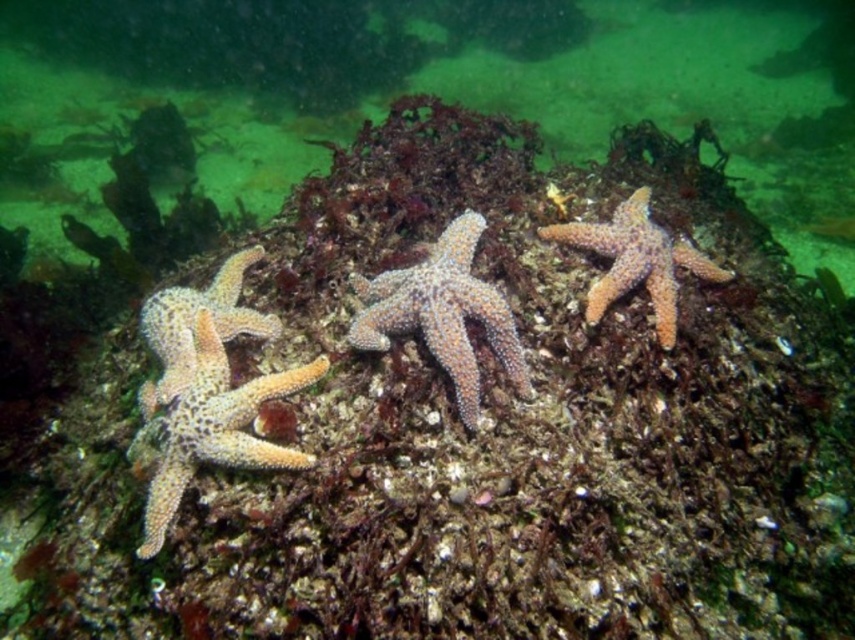
Does orange spiny starfish at upper right have a smaller size compared to orange spiny starfish at left?

Actually, orange spiny starfish at upper right might be larger than orange spiny starfish at left.

Between orange spiny starfish at upper right and orange spiny starfish at left, which one appears on the right side from the viewer's perspective?

From the viewer's perspective, orange spiny starfish at upper right appears more on the right side.

Does point (679, 257) come farther from viewer compared to point (226, 260)?

No, it is not.

Where is `orange spiny starfish at upper right`? The width and height of the screenshot is (855, 640). orange spiny starfish at upper right is located at coordinates [x=635, y=260].

Does orange rough starfish at left appear on the right side of orange spiny starfish at center?

In fact, orange rough starfish at left is to the left of orange spiny starfish at center.

Does point (166, 426) lie in front of point (469, 237)?

Yes, it is.

Image resolution: width=855 pixels, height=640 pixels. What do you see at coordinates (207, 416) in the screenshot?
I see `orange rough starfish at left` at bounding box center [207, 416].

Image resolution: width=855 pixels, height=640 pixels. Find the location of `orange rough starfish at left`. orange rough starfish at left is located at coordinates (207, 416).

Does orange rough starfish at left appear on the right side of orange spiny starfish at upper right?

No, orange rough starfish at left is not to the right of orange spiny starfish at upper right.

Is orange rough starfish at left taller than orange spiny starfish at upper right?

Indeed, orange rough starfish at left has a greater height compared to orange spiny starfish at upper right.

Find the location of a particular element. The width and height of the screenshot is (855, 640). orange rough starfish at left is located at coordinates pyautogui.click(x=207, y=416).

Image resolution: width=855 pixels, height=640 pixels. Find the location of `orange rough starfish at left`. orange rough starfish at left is located at coordinates (207, 416).